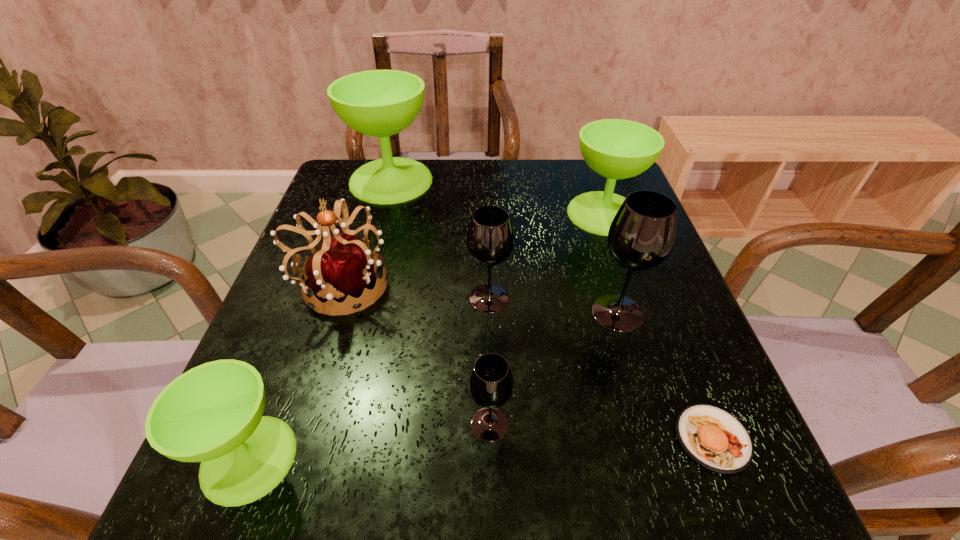
Select which green wineglass appears as the closest to the biggest gray wineglass. Please provide its 2D coordinates. Your answer should be formatted as a tuple, i.e. [(x, y)], where the tuple contains the x and y coordinates of a point satisfying the conditions above.

[(617, 149)]

Locate which green wineglass ranks in proximity to the second smallest green wineglass. Please provide its 2D coordinates. Your answer should be formatted as a tuple, i.e. [(x, y)], where the tuple contains the x and y coordinates of a point satisfying the conditions above.

[(380, 103)]

Where is `gray wineglass that is the closest to the shortest object`? The width and height of the screenshot is (960, 540). gray wineglass that is the closest to the shortest object is located at coordinates (641, 236).

At what (x,y) coordinates should I click in order to perform the action: click on the second closest gray wineglass to the nearest gray wineglass. Please return your answer as a coordinate pair (x, y). The width and height of the screenshot is (960, 540). Looking at the image, I should click on (641, 236).

Identify the location of free space that satisfies the following two spatial constraints: 1. on the front-facing side of the biggest gray wineglass; 2. on the right side of the tiara. (332, 312).

Find the location of a particular element. This screenshot has width=960, height=540. free location that satisfies the following two spatial constraints: 1. on the front-facing side of the tiara; 2. on the left side of the smallest gray wineglass is located at coordinates (297, 424).

Find the location of a particular element. This screenshot has height=540, width=960. free space that satisfies the following two spatial constraints: 1. on the front side of the biggest green wineglass; 2. on the left side of the shortest object is located at coordinates (322, 438).